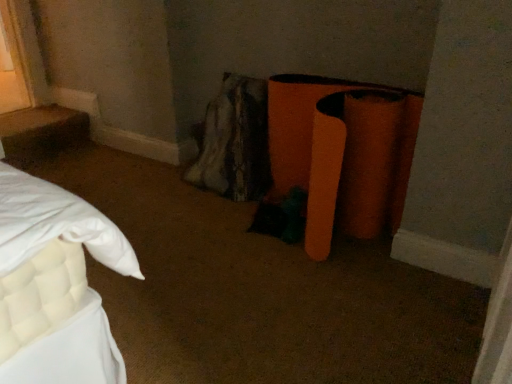
Describe the element at coordinates (309, 146) in the screenshot. The height and width of the screenshot is (384, 512). I see `orange matte stool at lower right` at that location.

Image resolution: width=512 pixels, height=384 pixels. Identify the location of orange matte stool at lower right. (309, 146).

Image resolution: width=512 pixels, height=384 pixels. What are the coordinates of `orange matte stool at lower right` in the screenshot? It's located at (309, 146).